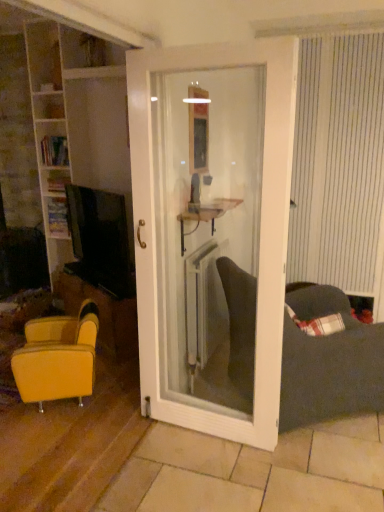
Identify the location of free space in front of leather-like yellow armchair at lower left. (53, 438).